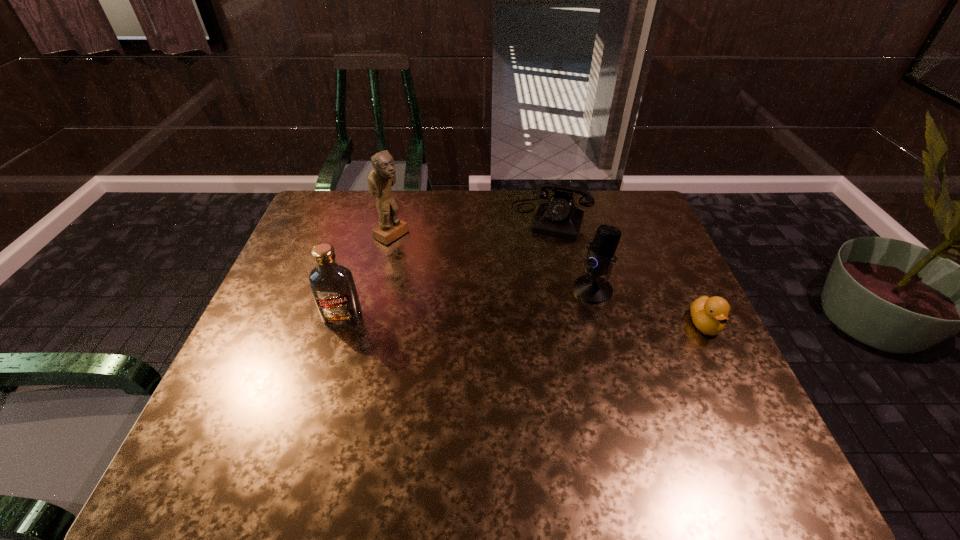
In the image, there is a desktop. Where is `free space at the near edge`? The width and height of the screenshot is (960, 540). free space at the near edge is located at coordinates (335, 391).

In the image, there is a desktop. What are the coordinates of `vacant area at the left edge` in the screenshot? It's located at (314, 313).

In the image, there is a desktop. Identify the location of blank space at the right edge. This screenshot has height=540, width=960. (652, 336).

This screenshot has height=540, width=960. In the image, there is a desktop. Identify the location of blank space at the far left corner. (332, 192).

This screenshot has width=960, height=540. What are the coordinates of `vacant space at the near left corner of the desktop` in the screenshot? It's located at (258, 398).

Find the location of a particular element. This screenshot has width=960, height=540. vacant space at the far right corner is located at coordinates (613, 217).

Locate an element on the screen. The height and width of the screenshot is (540, 960). vacant space at the near right corner of the desktop is located at coordinates (719, 396).

Image resolution: width=960 pixels, height=540 pixels. Identify the location of empty space between the figurine and the duckling. (548, 280).

Where is `empty location between the figurine and the telephone`? empty location between the figurine and the telephone is located at coordinates (471, 226).

I want to click on free space that is in between the rightmost object and the figurine, so click(548, 280).